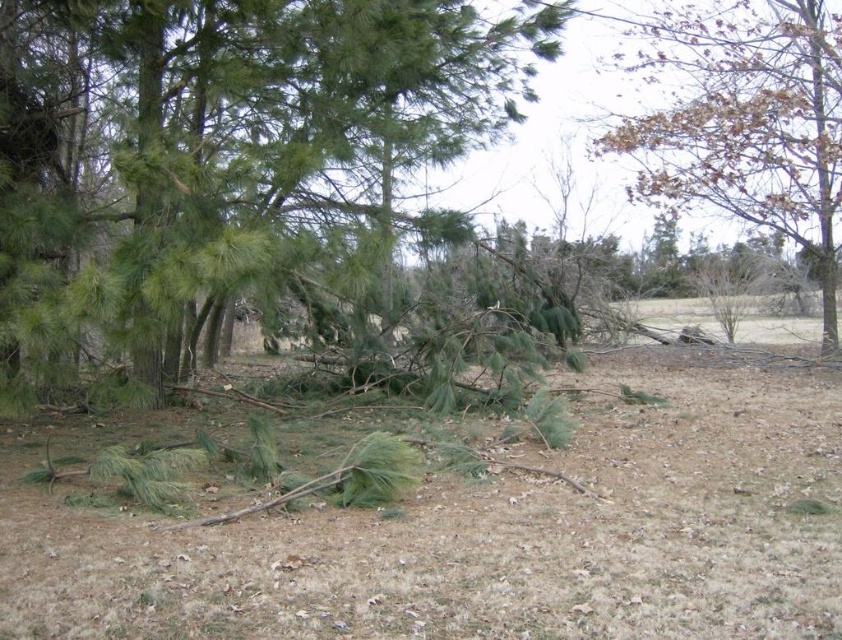
In the scene shown: Between brown dry grass at center and brown leafy tree at upper right, which one has more height?

brown leafy tree at upper right

Is point (720, 554) farther from viewer compared to point (781, 65)?

No, it is in front of (781, 65).

The width and height of the screenshot is (842, 640). What are the coordinates of `brown dry grass at center` in the screenshot? It's located at coord(491,536).

Is point (813, 598) less distant than point (104, 61)?

Yes, point (813, 598) is closer to viewer.

Can you confirm if brown dry grass at center is positioned to the left of green needle-like at center?

No, brown dry grass at center is not to the left of green needle-like at center.

Is point (278, 570) closer to viewer compared to point (25, 397)?

Yes, it is in front of point (25, 397).

I want to click on brown dry grass at center, so click(491, 536).

Consider the image. Between green needle-like at center and brown leafy tree at upper right, which one appears on the right side from the viewer's perspective?

From the viewer's perspective, brown leafy tree at upper right appears more on the right side.

Does green needle-like at center appear over brown leafy tree at upper right?

No.

Which is behind, point (126, 61) or point (818, 172)?

Positioned behind is point (818, 172).

I want to click on green needle-like at center, so click(x=228, y=150).